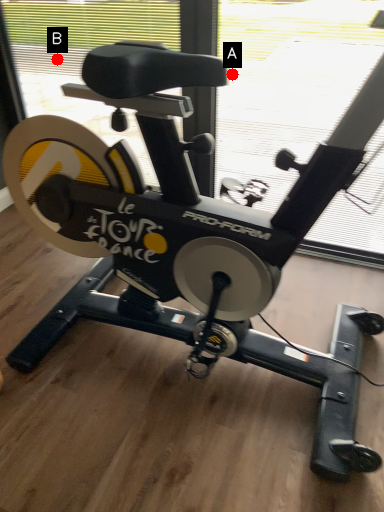
Question: Two points are circled on the image, labeled by A and B beside each circle. Which point is closer to the camera taking this photo?

Choices:
 (A) A is closer
 (B) B is closer

Answer: (A)